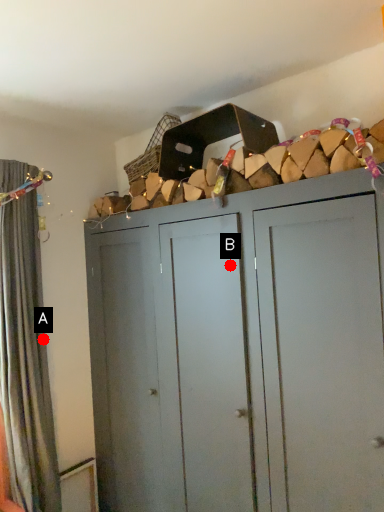
Question: Two points are circled on the image, labeled by A and B beside each circle. Which point is further to the camera?

Choices:
 (A) A is further
 (B) B is further

Answer: (A)